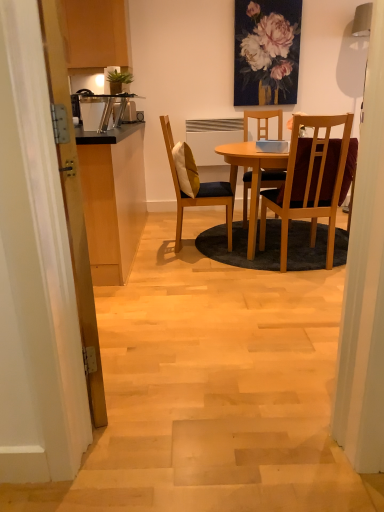
The image size is (384, 512). What are the coordinates of `free spot in front of wooden chair with dark cushioning at center, which ranks as the 1th chair in right-to-left order` in the screenshot? It's located at (305, 285).